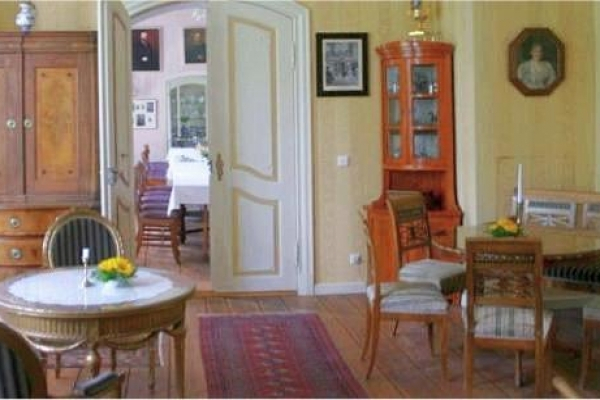
Locate an element on the screen. rug is located at coordinates (264, 357).